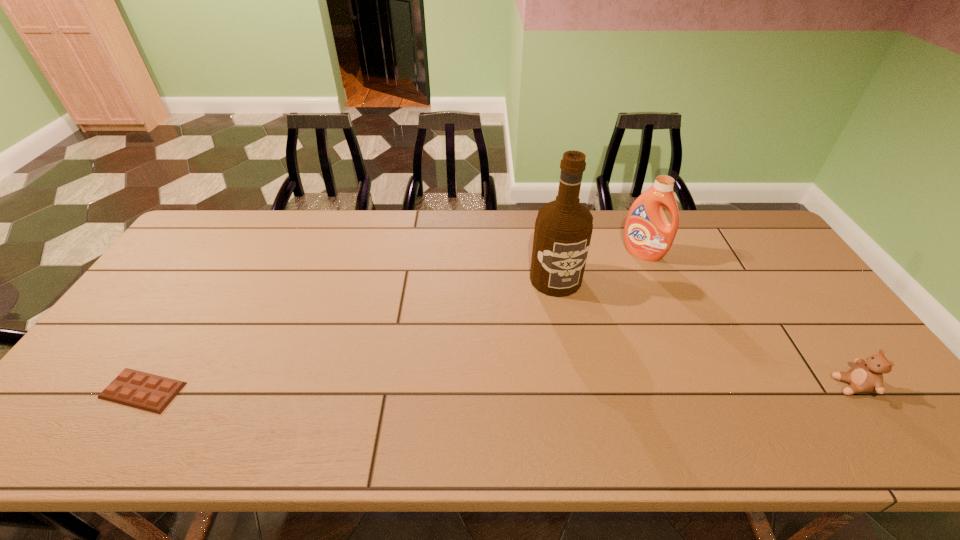
In order to click on chocolate bar in this screenshot , I will do `click(145, 391)`.

Find the location of a particular element. the shortest object is located at coordinates (145, 391).

Where is `the second shortest object`? The width and height of the screenshot is (960, 540). the second shortest object is located at coordinates (867, 376).

You are a GUI agent. You are given a task and a screenshot of the screen. Output one action in this format:
    pyautogui.click(x=<x>, y=<y>)
    Task: Click on the rightmost object
    The width and height of the screenshot is (960, 540).
    Given the screenshot: What is the action you would take?
    pyautogui.click(x=867, y=376)

This screenshot has width=960, height=540. Identify the location of the tallest object. 563,228.

Find the location of `alcohol`. alcohol is located at coordinates (563, 228).

This screenshot has height=540, width=960. What are the coordinates of `the third object from left to right` in the screenshot? It's located at (648, 235).

Identify the location of detergent. (648, 235).

At what (x,y) coordinates should I click in order to perform the action: click on vacant region located on the back of the shortest object. Please return your answer as a coordinate pair (x, y). Looking at the image, I should click on (219, 272).

I want to click on vacant space situated 0.280m on the front-facing side of the second shortest object, so click(720, 386).